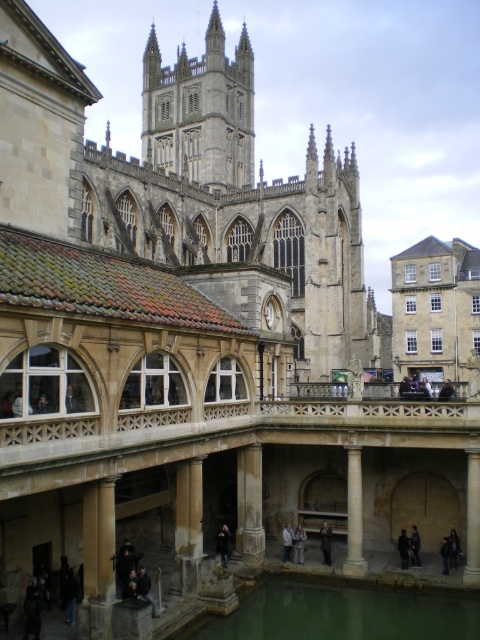
This screenshot has height=640, width=480. What do you see at coordinates (355, 515) in the screenshot? I see `white stone column at center` at bounding box center [355, 515].

Does point (360, 556) come closer to viewer compared to point (418, 564)?

Yes, point (360, 556) is closer to viewer.

Who is more distant from viewer, (350,465) or (410,538)?

Positioned behind is point (410,538).

At what (x,y) coordinates should I click in order to perform the action: click on white stone column at center. Please return your answer as a coordinate pair (x, y). Image resolution: width=480 pixels, height=640 pixels. Looking at the image, I should click on (355, 515).

The image size is (480, 640). Describe the element at coordinates (404, 548) in the screenshot. I see `dark brown leather jacket at lower center` at that location.

Can you confirm if dark brown leather jacket at lower center is bigger than black leather jacket at lower center?

Incorrect, dark brown leather jacket at lower center is not larger than black leather jacket at lower center.

Who is more distant from viewer, (399, 541) or (450, 554)?

Point (399, 541)

The width and height of the screenshot is (480, 640). What are the coordinates of `dark brown leather jacket at lower center` in the screenshot? It's located at (404, 548).

Can you confirm if dark gray fabric jacket at lower left is wider than dark brown leather jacket at lower center?

Correct, the width of dark gray fabric jacket at lower left exceeds that of dark brown leather jacket at lower center.

Identify the location of dark gray fabric jacket at lower left. The image size is (480, 640). (33, 609).

The width and height of the screenshot is (480, 640). What do you see at coordinates (33, 609) in the screenshot?
I see `dark gray fabric jacket at lower left` at bounding box center [33, 609].

This screenshot has height=640, width=480. In order to click on dark gray fabric jacket at lower left in this screenshot , I will do `click(33, 609)`.